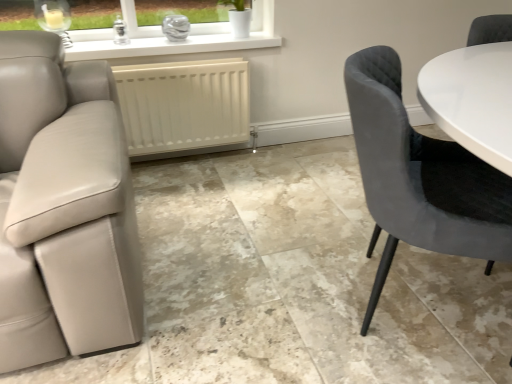
Where is `blank space above white matte radiator at center (from a real-world perspective)`? blank space above white matte radiator at center (from a real-world perspective) is located at coordinates (148, 61).